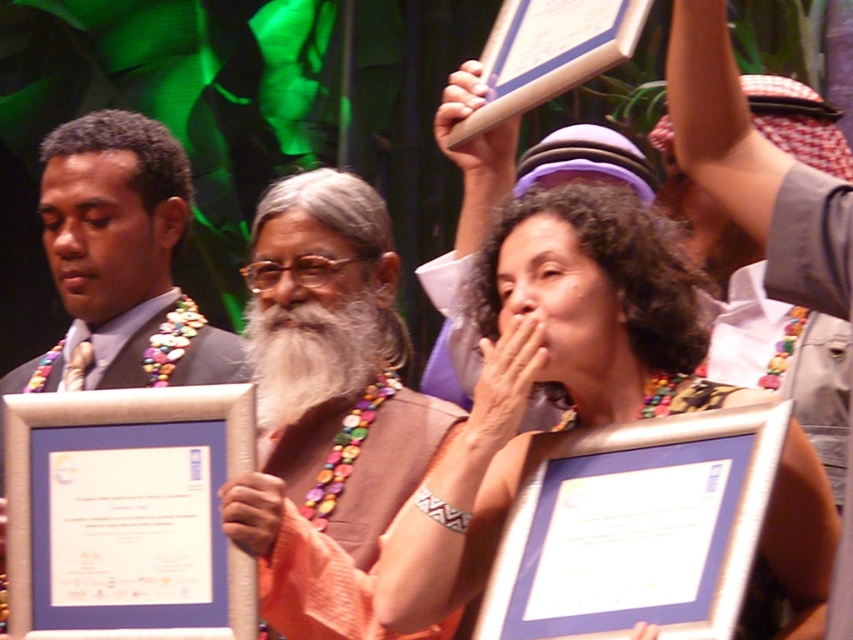
Is matte silver frame at lower center wider than brown fabric at center?

Yes.

Consider the image. Which is more to the left, matte silver frame at lower center or brown fabric at center?

brown fabric at center is more to the left.

Identify the location of matte silver frame at lower center. (635, 529).

Is multicolored beaded necklace at center to the right of brown fabric at center from the viewer's perspective?

Yes, multicolored beaded necklace at center is to the right of brown fabric at center.

Is point (666, 340) farther from viewer compared to point (323, 184)?

No, (666, 340) is closer to viewer.

This screenshot has width=853, height=640. Find the location of `multicolored beaded necklace at center`. multicolored beaded necklace at center is located at coordinates (548, 371).

Which of these two, white paper at center or brown fabric at center, stands shorter?

With less height is brown fabric at center.

Based on the photo, can you confirm if white paper at center is thinner than brown fabric at center?

No, white paper at center is not thinner than brown fabric at center.

I want to click on white paper at center, so click(x=128, y=513).